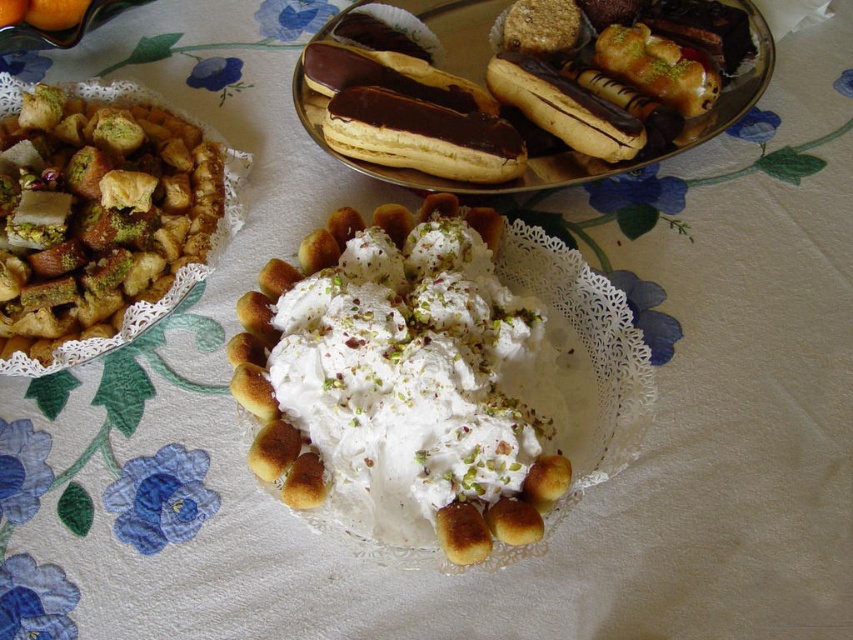
Question: From the image, what is the correct spatial relationship of white fluffy dessert at center in relation to shiny chocolate eclair at upper center?

Choices:
 (A) right
 (B) left

Answer: (B)

Question: From the image, what is the correct spatial relationship of white fluffy dessert at center in relation to chocolate-coated pastry at upper center?

Choices:
 (A) below
 (B) above

Answer: (A)

Question: Among these objects, which one is farthest from the camera?

Choices:
 (A) chocolate-coated pastry at upper center
 (B) white fluffy dessert at center
 (C) shiny chocolate eclair at upper center

Answer: (C)

Question: Which point is farther to the camera?

Choices:
 (A) white fluffy dessert at center
 (B) chocolate-coated pastry at upper right

Answer: (B)

Question: Is the position of pistachio crumbly pastry at left more distant than that of golden brown pastry at center?

Choices:
 (A) no
 (B) yes

Answer: (B)

Question: Which of the following is the farthest from the observer?

Choices:
 (A) (387, 332)
 (B) (496, 61)
 (C) (24, 250)
 (D) (469, 515)

Answer: (B)